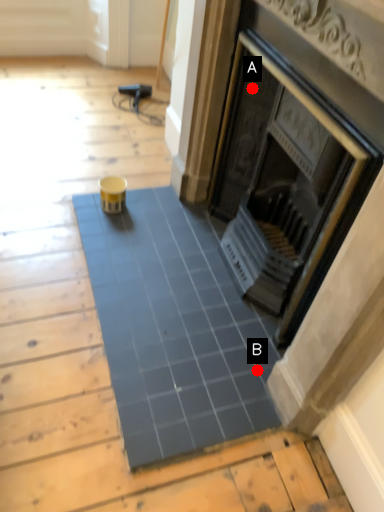
Question: Two points are circled on the image, labeled by A and B beside each circle. Which of the following is the closest to the observer?

Choices:
 (A) A is closer
 (B) B is closer

Answer: (B)